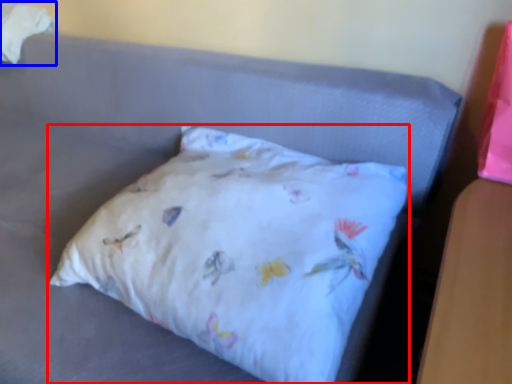
Question: Which of the following is the closest to the observer, pillow (highlighted by a red box) or material (highlighted by a blue box)?

Choices:
 (A) pillow
 (B) material

Answer: (A)